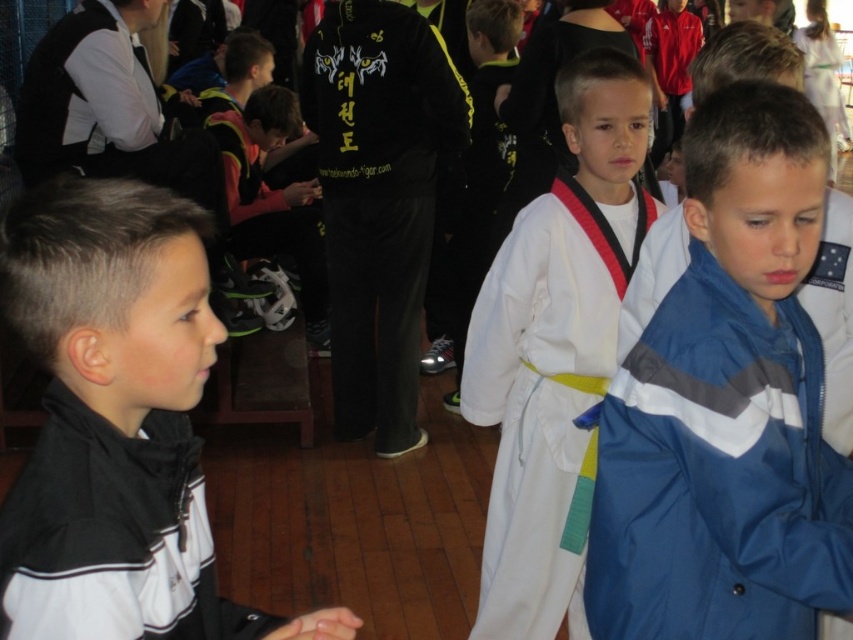
From the picture: You are a small robot with a width of 1 meter. You need to move from the black matte jacket at left to the white cotton karate gi at center. Is there enough space for you to navigate the path between them?

The distance between the black matte jacket at left and the white cotton karate gi at center is 1.51 meters. Since the robot is 1 meter wide, there is sufficient space for it to navigate the path between them.